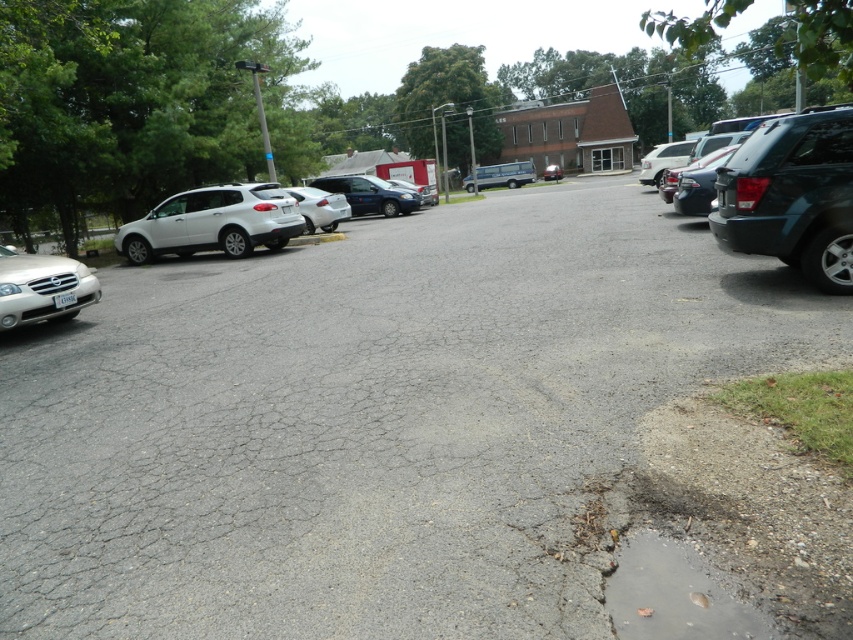
Can you confirm if satin blue sedan at center is positioned to the left of matte silver van at center?

Yes, satin blue sedan at center is to the left of matte silver van at center.

Who is more forward, (358, 180) or (561, 173)?

Positioned in front is point (358, 180).

Identify the location of satin blue sedan at center. This screenshot has width=853, height=640. (370, 195).

Can you confirm if teal matte suv at right is positioned to the right of clear asphalt puddle at lower right?

Indeed, teal matte suv at right is positioned on the right side of clear asphalt puddle at lower right.

Does teal matte suv at right come in front of clear asphalt puddle at lower right?

No, teal matte suv at right is behind clear asphalt puddle at lower right.

Is point (761, 212) positioned after point (689, 573)?

Yes, point (761, 212) is farther from viewer.

In order to click on teal matte suv at right in this screenshot , I will do `click(792, 195)`.

Who is positioned more to the left, clear asphalt puddle at lower right or matte silver van at center?

Positioned to the left is clear asphalt puddle at lower right.

Does clear asphalt puddle at lower right appear under matte silver van at center?

Yes.

I want to click on clear asphalt puddle at lower right, so (x=674, y=595).